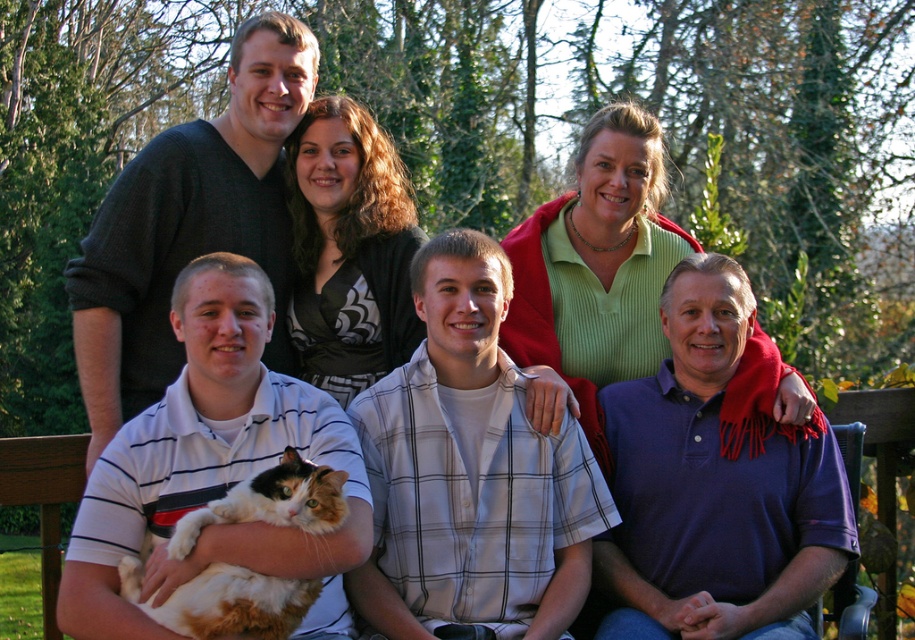
Does point (347, 435) come closer to viewer compared to point (294, 625)?

No, (347, 435) is further to viewer.

At what (x,y) coordinates should I click in order to perform the action: click on calico fur cat at lower left. Please return your answer as a coordinate pair (x, y). Looking at the image, I should click on (212, 467).

What do you see at coordinates (212, 467) in the screenshot? The height and width of the screenshot is (640, 915). I see `calico fur cat at lower left` at bounding box center [212, 467].

The width and height of the screenshot is (915, 640). I want to click on calico fur cat at lower left, so click(212, 467).